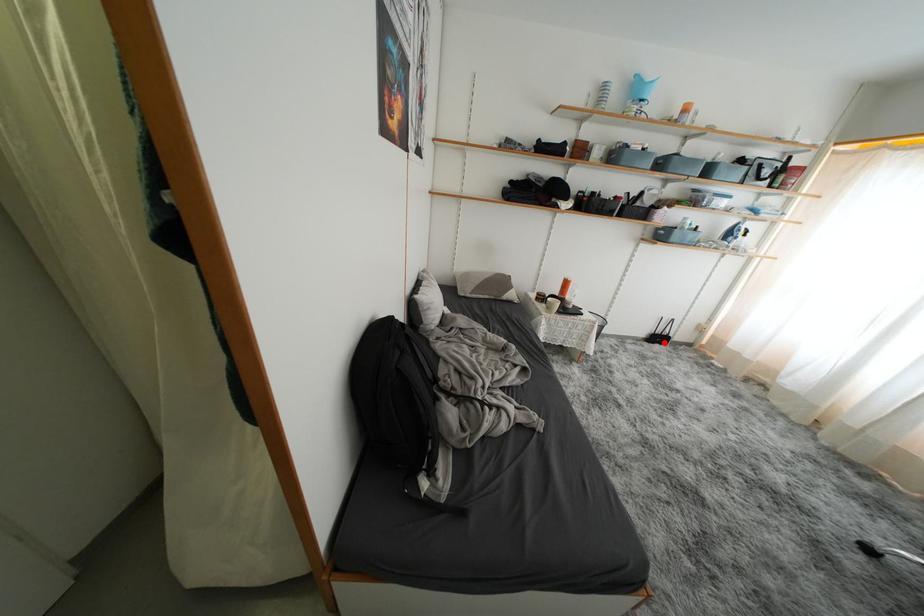
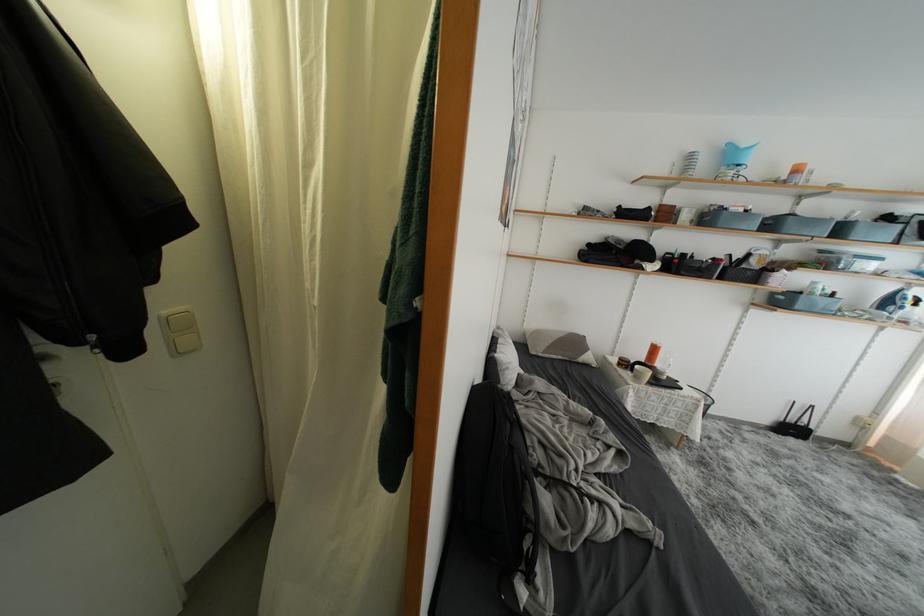
Question: I am providing you with two images of the same scene from different viewpoints. A red point is marked on the first image. At the location where the point appears in image 1, is it still visible in image 2?

Choices:
 (A) Yes
 (B) No

Answer: (A)